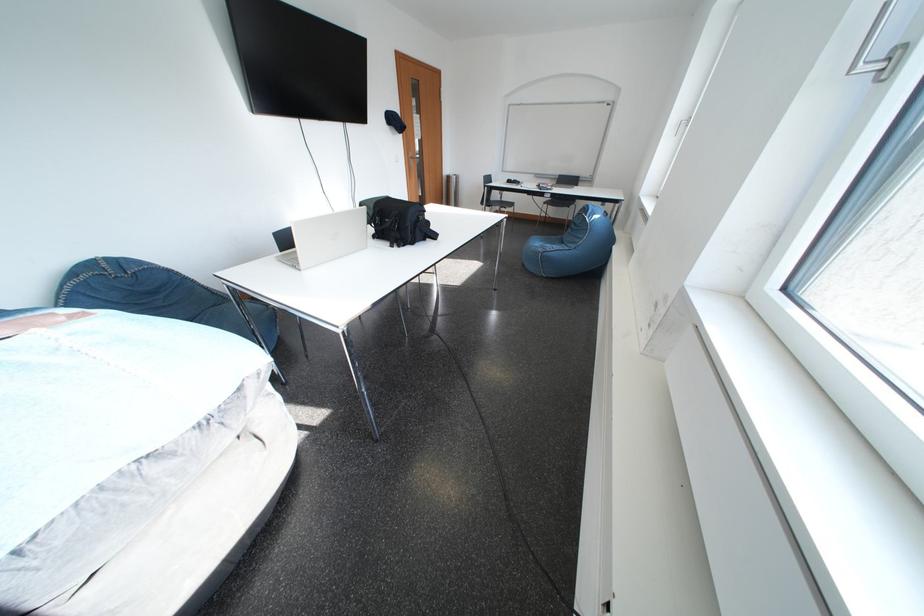
Identify the location of chair sitting surface. pos(560,198).